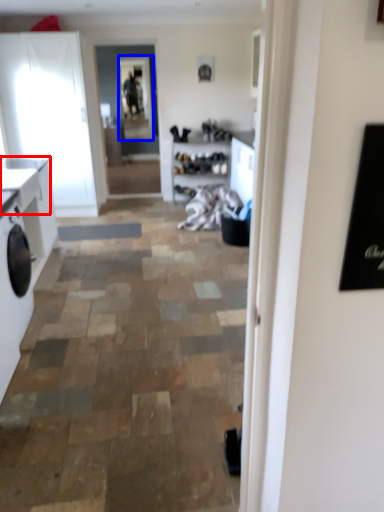
Question: Which object is closer to the camera taking this photo, counter top (highlighted by a red box) or window screen (highlighted by a blue box)?

Choices:
 (A) counter top
 (B) window screen

Answer: (A)